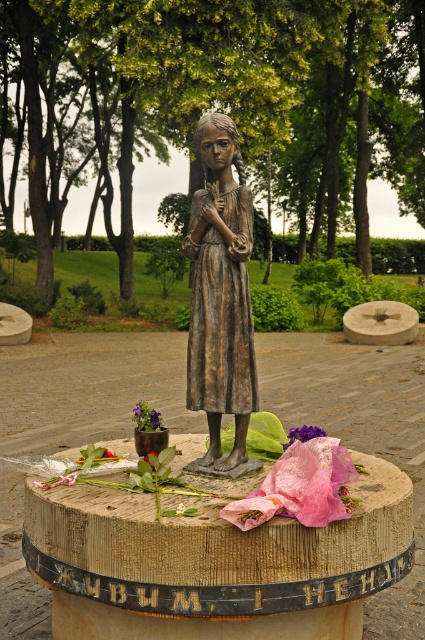
Question: Does pink translucent petals at center have a larger size compared to pink paper flower at center?

Choices:
 (A) no
 (B) yes

Answer: (B)

Question: Which object is farther from the camera taking this photo?

Choices:
 (A) pink translucent petals at center
 (B) bronze statue at center
 (C) pink paper flower at center
 (D) green leafy at center

Answer: (D)

Question: Which of the following is the closest to the observer?

Choices:
 (A) pink translucent petals at center
 (B) matte purple flower at center
 (C) bronze statue at center
 (D) green leafy at center

Answer: (A)

Question: Which point appears closest to the camera in this image?

Choices:
 (A) (71, 481)
 (B) (136, 428)

Answer: (A)

Question: Is bronze statue at center to the left of purple fabric flower at center from the viewer's perspective?

Choices:
 (A) no
 (B) yes

Answer: (B)

Question: Is green leafy at center positioned at the back of pink paper flower at center?

Choices:
 (A) no
 (B) yes

Answer: (B)